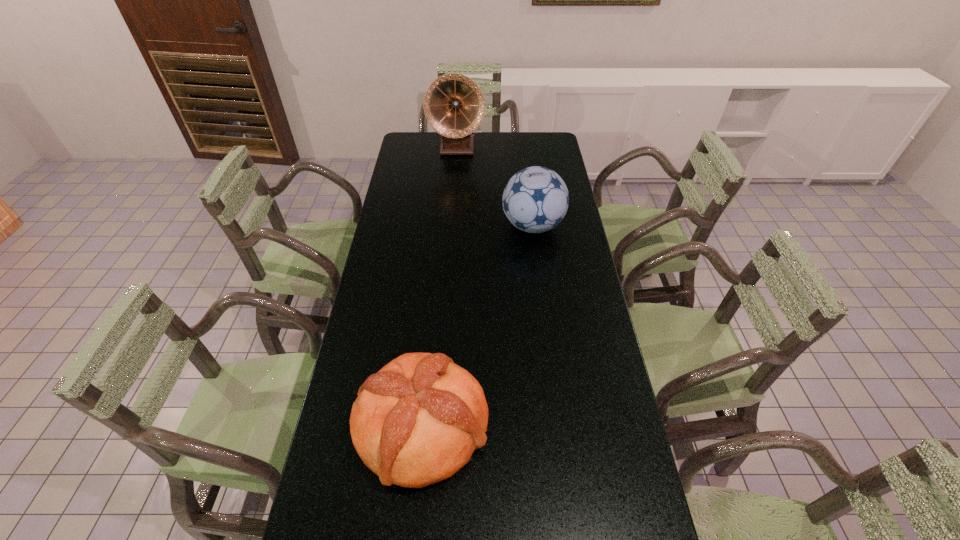
Locate an element on the screen. Image resolution: width=960 pixels, height=540 pixels. free space located 0.140m on the right of the bread is located at coordinates (543, 425).

The image size is (960, 540). I want to click on object located in the far edge section of the desktop, so click(x=454, y=106).

At what (x,y) coordinates should I click in order to perform the action: click on phonograph record present at the left edge. Please return your answer as a coordinate pair (x, y). This screenshot has height=540, width=960. Looking at the image, I should click on (454, 106).

Identify the location of bread present at the left edge. The image size is (960, 540). (417, 421).

At what (x,y) coordinates should I click in order to perform the action: click on object located at the right edge. Please return your answer as a coordinate pair (x, y). Looking at the image, I should click on (535, 200).

Find the location of a particular element. Image resolution: width=960 pixels, height=540 pixels. object that is at the far left corner is located at coordinates (454, 106).

In the image, there is a desktop. In order to click on free space at the left edge in this screenshot , I will do `click(426, 170)`.

Locate an element on the screen. vacant space at the right edge of the desktop is located at coordinates (544, 275).

Identify the location of free area in between the shortest object and the tallest object. (440, 286).

Where is `unoccupied area between the tallest object and the second tallest object`? unoccupied area between the tallest object and the second tallest object is located at coordinates (494, 186).